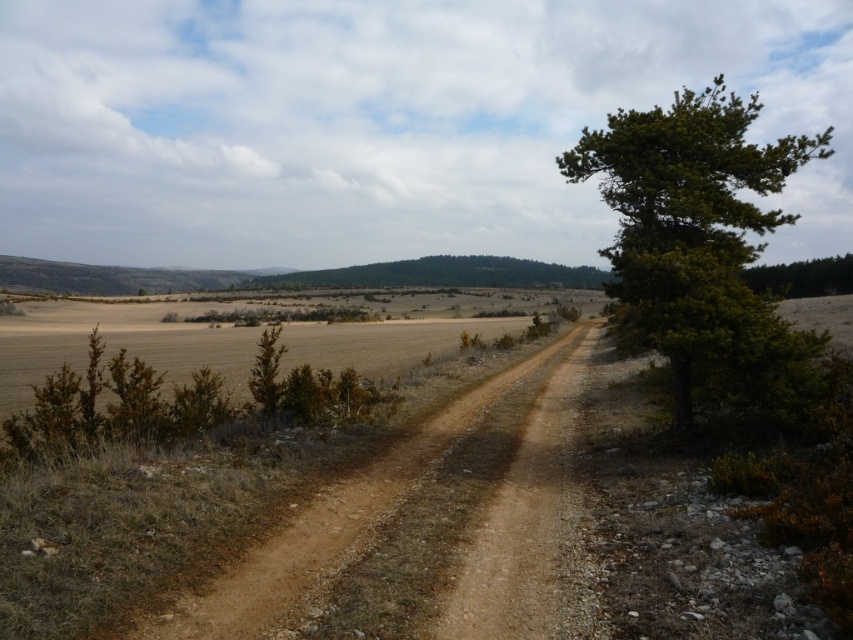
Question: Can you confirm if green leafy tree at right is smaller than brown dirt track at center?

Choices:
 (A) no
 (B) yes

Answer: (A)

Question: Is green leafy tree at right wider than brown dirt track at center?

Choices:
 (A) yes
 (B) no

Answer: (A)

Question: Is green leafy tree at right bigger than brown dirt track at center?

Choices:
 (A) no
 (B) yes

Answer: (B)

Question: Among these points, which one is nearest to the camera?

Choices:
 (A) (708, 378)
 (B) (345, 499)

Answer: (B)

Question: Which object appears closest to the camera in this image?

Choices:
 (A) brown dirt track at center
 (B) green leafy tree at right

Answer: (A)